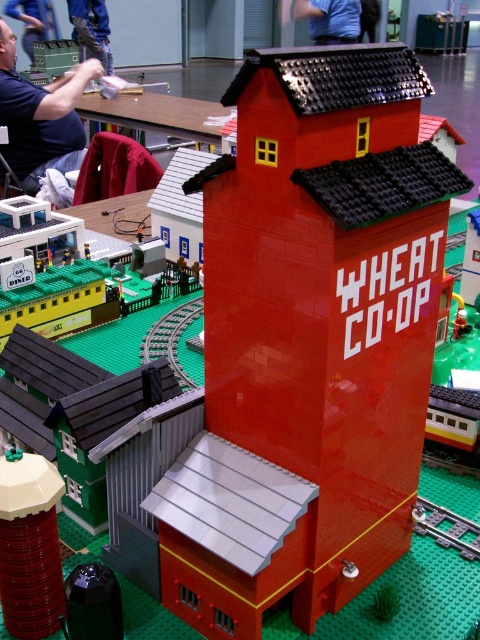
You are standing at the center of the Lego town scene. Looking at the blue shirt at upper left, can you tell me its exact 2D coordinates?

The blue shirt at upper left is located at the 2D coordinates of point (40, 113).

You are a Lego figure standing at the base of the red brick silo. You see a blue shirt at upper left and a blue fabric shirt at upper center. Which shirt is closer to you?

The blue shirt at upper left is closer to you because it is in front of the blue fabric shirt at upper center.

You are a drone operator trying to capture aerial footage of the Lego town. You have two points marked on your map for camera placement. The first point is at coordinates point (58, 156) and the second is at point (299, 12). Which point would give you a better vantage point to film the entire Lego town without obstruction?

Point (58, 156) is closer to the viewer than point (299, 12), so it would provide a better vantage point as it is positioned closer and likely offers a clearer, less obstructed view of the entire Lego town.